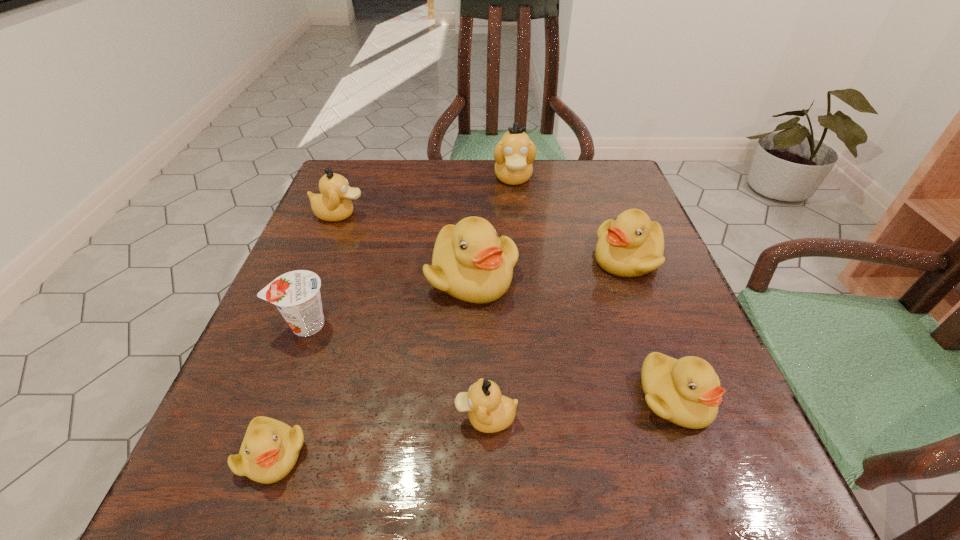
You are a GUI agent. You are given a task and a screenshot of the screen. Output one action in this format:
    pyautogui.click(x=<x>, y=<y>)
    Task: Click on the yellow duckling that is the third closest to the leftmost yellow duckling
    
    Given the screenshot: What is the action you would take?
    pyautogui.click(x=632, y=245)

Locate an element on the screen. The width and height of the screenshot is (960, 540). free spot that satisfies the following two spatial constraints: 1. on the face of the sixth nearest duckling; 2. on the right side of the yogurt is located at coordinates (296, 325).

Image resolution: width=960 pixels, height=540 pixels. I want to click on free space that satisfies the following two spatial constraints: 1. on the front-facing side of the second biggest yellow duckling; 2. on the front-facing side of the shortest object, so click(701, 455).

Find the location of a particular element. free location that satisfies the following two spatial constraints: 1. on the front-facing side of the second biggest yellow duckling; 2. on the front-facing side of the second smallest yellow duckling is located at coordinates (x=680, y=398).

What are the coordinates of `free point that satisfies the following two spatial constraints: 1. on the front-facing side of the third smallest yellow duckling; 2. on the front-facing side of the biggest yellow duckling` in the screenshot? It's located at (634, 276).